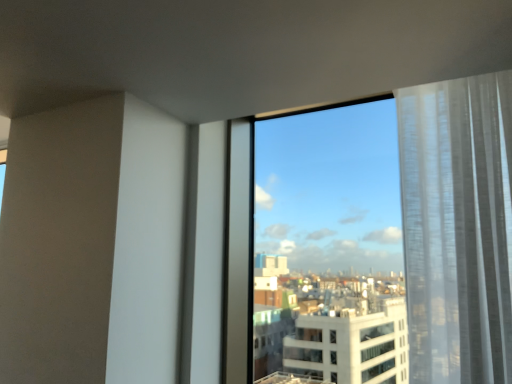
What do you see at coordinates (458, 227) in the screenshot? I see `transparent glass window at center` at bounding box center [458, 227].

Locate an element on the screen. Image resolution: width=512 pixels, height=384 pixels. transparent glass window at center is located at coordinates (458, 227).

The image size is (512, 384). Describe the element at coordinates (458, 227) in the screenshot. I see `white sheer curtain at right` at that location.

In the scene shown: What is the approximate height of white sheer curtain at right?

white sheer curtain at right is 1.07 meters in height.

Where is `white sheer curtain at right`? The height and width of the screenshot is (384, 512). white sheer curtain at right is located at coordinates (458, 227).

This screenshot has width=512, height=384. In order to click on transparent glass window at center in this screenshot , I will do `click(458, 227)`.

Based on their positions, is transparent glass window at center located to the left or right of white sheer curtain at right?

transparent glass window at center is to the left of white sheer curtain at right.

Considering the relative positions of transparent glass window at center and white sheer curtain at right in the image provided, is transparent glass window at center in front of white sheer curtain at right?

No, transparent glass window at center is behind white sheer curtain at right.

Does point (448, 197) come closer to viewer compared to point (481, 380)?

No.

From the image's perspective, is transparent glass window at center positioned above or below white sheer curtain at right?

transparent glass window at center is below white sheer curtain at right.

From a real-world perspective, is transparent glass window at center above or below white sheer curtain at right?

In terms of real-world spatial position, transparent glass window at center is below white sheer curtain at right.

Is transparent glass window at center wider than white sheer curtain at right?

No.

Can you confirm if transparent glass window at center is taller than white sheer curtain at right?

Yes, transparent glass window at center is taller than white sheer curtain at right.

Can you confirm if transparent glass window at center is smaller than white sheer curtain at right?

Incorrect, transparent glass window at center is not smaller in size than white sheer curtain at right.

Consider the image. Does transparent glass window at center contain white sheer curtain at right?

Actually, white sheer curtain at right is outside transparent glass window at center.

From the picture: Is transparent glass window at center with white sheer curtain at right?

Yes, transparent glass window at center and white sheer curtain at right clearly make contact.

Is transparent glass window at center oriented away from white sheer curtain at right?

That's not correct — transparent glass window at center is not looking away from white sheer curtain at right.

Based on the photo, how different are the orientations of transparent glass window at center and white sheer curtain at right in degrees?

The angle between the facing direction of transparent glass window at center and the facing direction of white sheer curtain at right is 0.639 degrees.

How far apart are transparent glass window at center and white sheer curtain at right?

They are 0.21 inches apart.

The height and width of the screenshot is (384, 512). What are the coordinates of `curtain above the transparent glass window at center (from the image's perspective)` in the screenshot? It's located at (458, 227).

Between white sheer curtain at right and transparent glass window at center, which one appears on the left side from the viewer's perspective?

transparent glass window at center.

Is white sheer curtain at right closer to camera compared to transparent glass window at center?

Yes, white sheer curtain at right is closer to the camera.

Which is behind, point (472, 151) or point (412, 231)?

The point (412, 231) is farther from the camera.

From the image's perspective, does white sheer curtain at right appear lower than transparent glass window at center?

No, from the image's perspective, white sheer curtain at right is not below transparent glass window at center.

From a real-world perspective, is white sheer curtain at right positioned above or below transparent glass window at center?

Clearly, from a real-world perspective, white sheer curtain at right is above transparent glass window at center.

Which object is thinner, white sheer curtain at right or transparent glass window at center?

transparent glass window at center.

Based on the photo, in terms of height, does white sheer curtain at right look taller or shorter compared to transparent glass window at center?

Clearly, white sheer curtain at right is shorter compared to transparent glass window at center.

From the picture: In terms of size, does white sheer curtain at right appear bigger or smaller than transparent glass window at center?

In the image, white sheer curtain at right appears to be smaller than transparent glass window at center.

Do you think white sheer curtain at right is within transparent glass window at center, or outside of it?

white sheer curtain at right is located beyond the bounds of transparent glass window at center.

Is white sheer curtain at right far away from transparent glass window at center?

No, white sheer curtain at right is not far away from transparent glass window at center.

Does white sheer curtain at right turn towards transparent glass window at center?

No, white sheer curtain at right is not aimed at transparent glass window at center.

Where is `window behind the white sheer curtain at right`? window behind the white sheer curtain at right is located at coordinates (458, 227).

I want to click on curtain that appears in front of the transparent glass window at center, so click(458, 227).

Where is `curtain above the transparent glass window at center (from a real-world perspective)`? The image size is (512, 384). curtain above the transparent glass window at center (from a real-world perspective) is located at coordinates (458, 227).